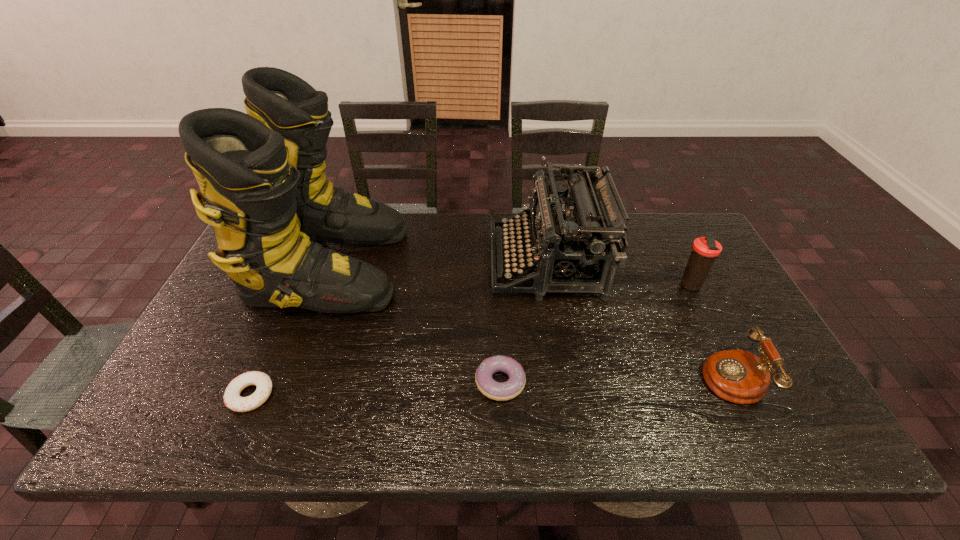
You are a GUI agent. You are given a task and a screenshot of the screen. Output one action in this format:
    pyautogui.click(x=<x>, y=<y>)
    Task: Click on the ski boots
    The width and height of the screenshot is (960, 540).
    Given the screenshot: What is the action you would take?
    pyautogui.click(x=262, y=177)

The width and height of the screenshot is (960, 540). Find the location of `typewriter`. typewriter is located at coordinates (582, 245).

Locate an element on the screen. The image size is (960, 540). thermos bottle is located at coordinates (705, 250).

What are the coordinates of `the third shortest object` in the screenshot? It's located at (738, 376).

The image size is (960, 540). I want to click on the taller doughnut, so click(x=500, y=391).

Where is `the right doughnut`? the right doughnut is located at coordinates (500, 391).

Find the location of a particular element. the left doughnut is located at coordinates (232, 399).

The height and width of the screenshot is (540, 960). I want to click on the shortest object, so click(x=232, y=399).

What are the coordinates of `vacant space located 0.050m on the left of the tallest object` in the screenshot? It's located at (241, 266).

Where is `vacant space located on the typing side of the typewriter`? The image size is (960, 540). vacant space located on the typing side of the typewriter is located at coordinates (390, 262).